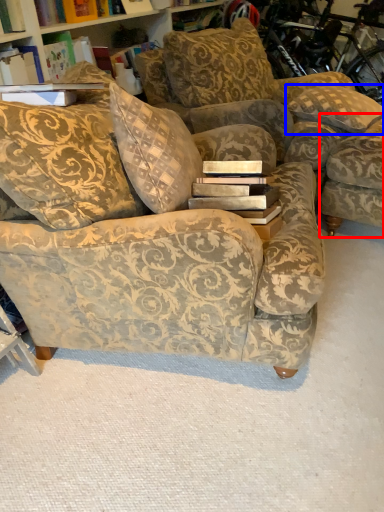
Question: Which object appears closest to the camera in this image, swivel chair (highlighted by a red box) or pillow (highlighted by a blue box)?

Choices:
 (A) swivel chair
 (B) pillow

Answer: (A)